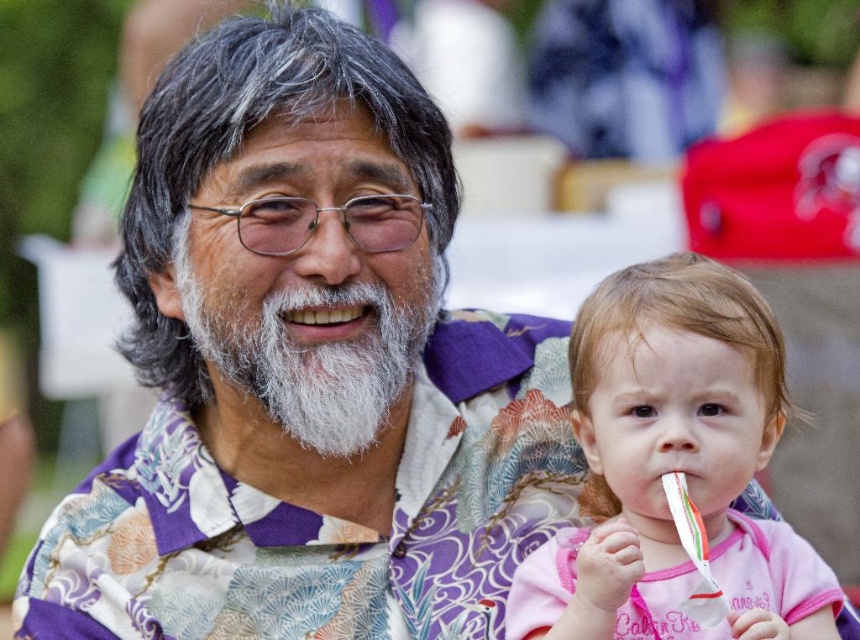
Is white matte beard at center to the right of white plastic toothbrush at lower right from the viewer's perspective?

Incorrect, white matte beard at center is not on the right side of white plastic toothbrush at lower right.

Is point (203, 340) closer to viewer compared to point (674, 509)?

No, (203, 340) is further to viewer.

This screenshot has height=640, width=860. I want to click on white matte beard at center, so click(x=314, y=349).

Locate an element on the screen. The width and height of the screenshot is (860, 640). white matte beard at center is located at coordinates (314, 349).

Is point (774, 353) farther from viewer compared to point (410, 365)?

No, it is in front of (410, 365).

Identify the location of pink fabric at center. The height and width of the screenshot is (640, 860). (673, 465).

Where is `pink fabric at center`? This screenshot has height=640, width=860. pink fabric at center is located at coordinates (673, 465).

Between pink fabric at center and white matte teeth at center, which one appears on the right side from the viewer's perspective?

pink fabric at center is more to the right.

Describe the element at coordinates (673, 465) in the screenshot. I see `pink fabric at center` at that location.

The image size is (860, 640). What do you see at coordinates (673, 465) in the screenshot?
I see `pink fabric at center` at bounding box center [673, 465].

Identify the location of pink fabric at center. The image size is (860, 640). (673, 465).